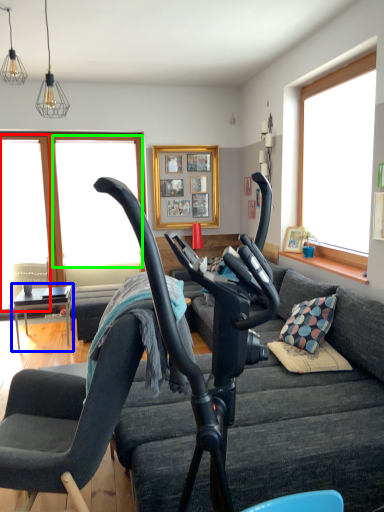
Question: Which is farther away from window screen (highlighted by a red box)? table (highlighted by a blue box) or window screen (highlighted by a green box)?

Choices:
 (A) table
 (B) window screen

Answer: (A)